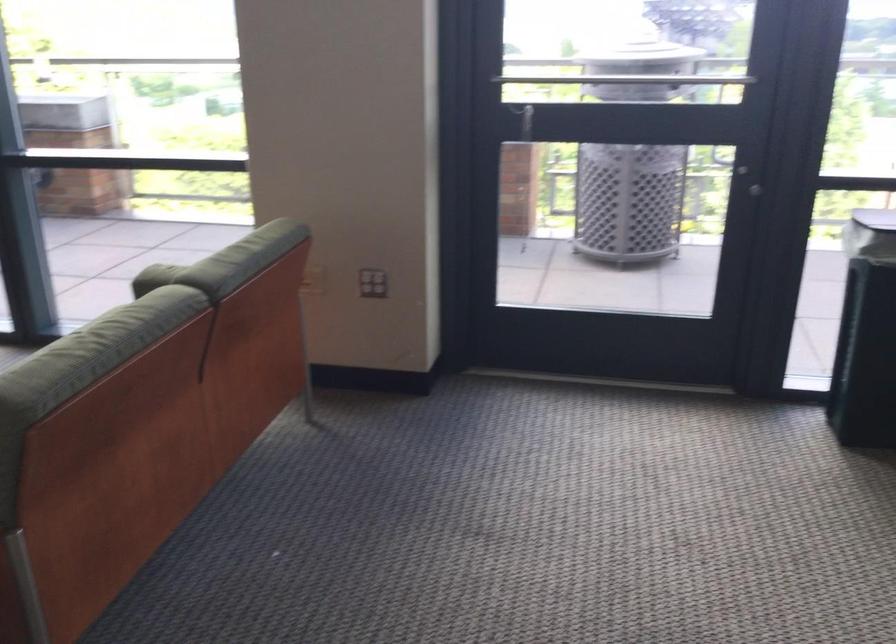
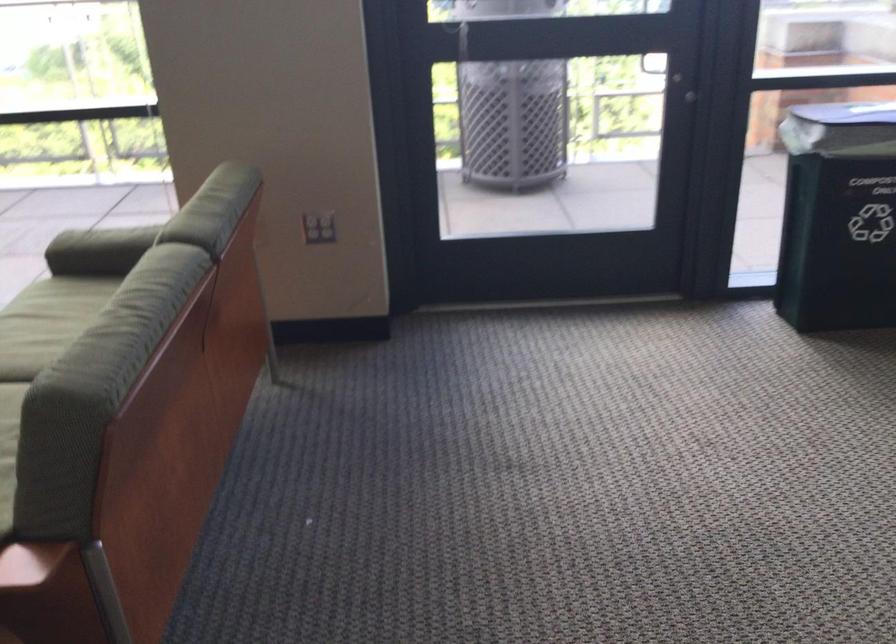
Find the pixel in the second image that matches [746,194] in the first image.

(691, 98)